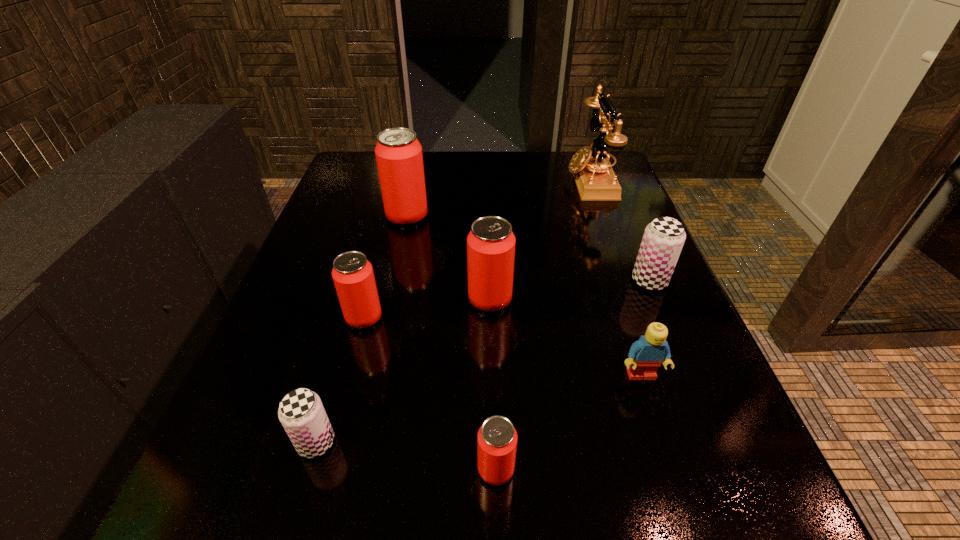
Find the location of a particular element. This screenshot has width=960, height=540. vacant area at the near edge is located at coordinates (365, 510).

Image resolution: width=960 pixels, height=540 pixels. Identify the location of vacant space at the left edge of the desktop. (270, 367).

Identify the location of vacant area at the right edge. (622, 214).

Find the location of a particular element. free space at the near right corner is located at coordinates pos(784,528).

The image size is (960, 540). What are the coordinates of `empty location between the nearest red beer can and the second smallest red beer can` in the screenshot? It's located at (430, 394).

The width and height of the screenshot is (960, 540). Identify the location of blank region between the nearer purple beer can and the tallest beer can. (362, 329).

The image size is (960, 540). I want to click on unoccupied area between the second biggest red beer can and the beige telephone, so click(x=540, y=240).

You are a GUI agent. You are given a task and a screenshot of the screen. Output one action in this format:
    pyautogui.click(x=<x>, y=<y>)
    Task: Click on the vacant space in between the beige telephone and the Lego
    
    Given the screenshot: What is the action you would take?
    615,278

Identify the location of empty space that is in between the Lego and the nearest red beer can. (568, 422).

The height and width of the screenshot is (540, 960). Find the location of `free space between the nearest red beer can and the third nearest object`. free space between the nearest red beer can and the third nearest object is located at coordinates (568, 422).